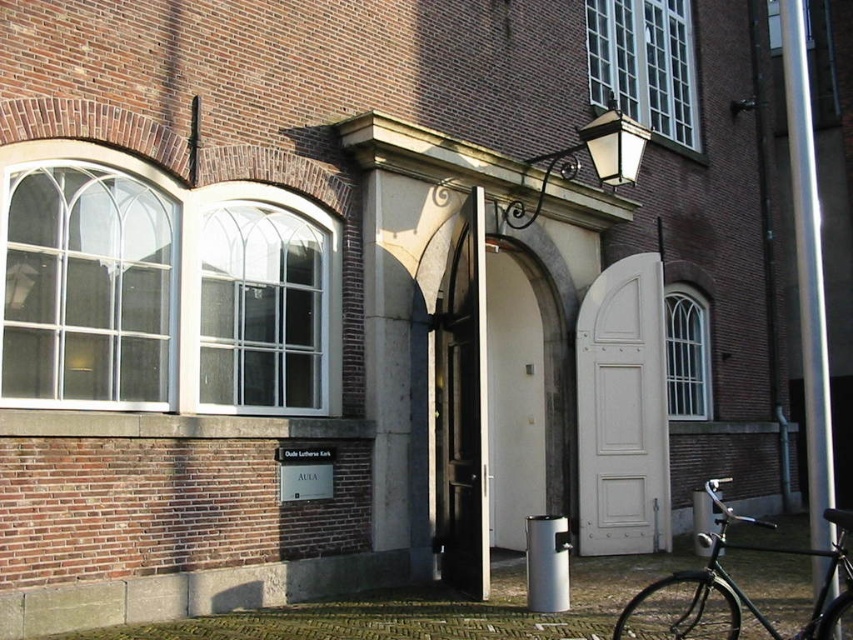
Does clear glass window at upper left have a lesser height compared to white wooden door at center?

Yes.

Where is `clear glass window at upper left`? clear glass window at upper left is located at coordinates (88, 288).

Who is positioned more to the left, clear glass window at upper left or clear glass window at upper right?

clear glass window at upper left

Identify the location of clear glass window at upper left. (88, 288).

This screenshot has width=853, height=640. Find the location of `clear glass window at upper left`. clear glass window at upper left is located at coordinates (88, 288).

Does point (613, 486) come farther from viewer compared to point (689, 632)?

That is True.

Between white wooden door at center and shiny black bicycle at lower right, which one appears on the left side from the viewer's perspective?

shiny black bicycle at lower right is more to the left.

The height and width of the screenshot is (640, 853). What do you see at coordinates (622, 412) in the screenshot?
I see `white wooden door at center` at bounding box center [622, 412].

Identify the location of white wooden door at center. (622, 412).